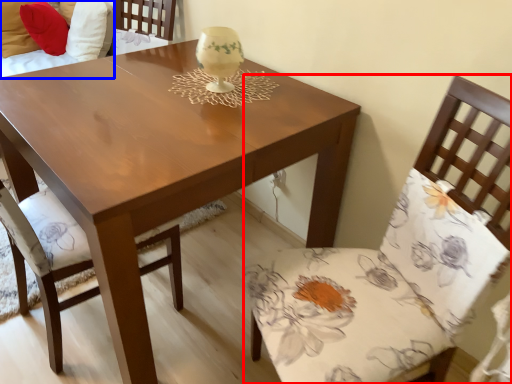
Question: Which of the following is the farthest to the observer, chair (highlighted by a red box) or couch (highlighted by a blue box)?

Choices:
 (A) chair
 (B) couch

Answer: (B)